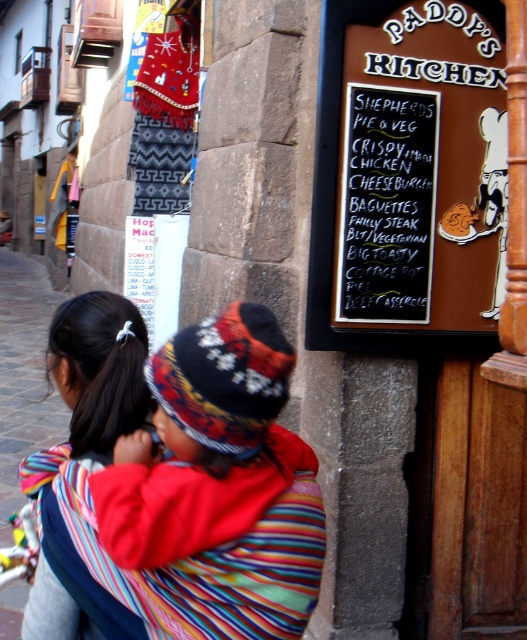
Question: Is multicolored woven cloth at center positioned before multicolored woven fabric at center?

Choices:
 (A) yes
 (B) no

Answer: (A)

Question: Which point is closer to the camera?

Choices:
 (A) multicolored woven fabric at center
 (B) multicolored woven cloth at center
 (C) brown chalkboard at upper right

Answer: (B)

Question: Is multicolored woven cloth at center to the left of brown chalkboard at upper right from the viewer's perspective?

Choices:
 (A) no
 (B) yes

Answer: (B)

Question: Which object appears farthest from the camera in this image?

Choices:
 (A) multicolored woven fabric at center
 (B) multicolored woven cloth at center

Answer: (A)

Question: Can you confirm if multicolored woven cloth at center is positioned above brown chalkboard at upper right?

Choices:
 (A) no
 (B) yes

Answer: (A)

Question: Considering the real-world distances, which object is farthest from the multicolored woven fabric at center?

Choices:
 (A) multicolored woven cloth at center
 (B) brown chalkboard at upper right

Answer: (B)